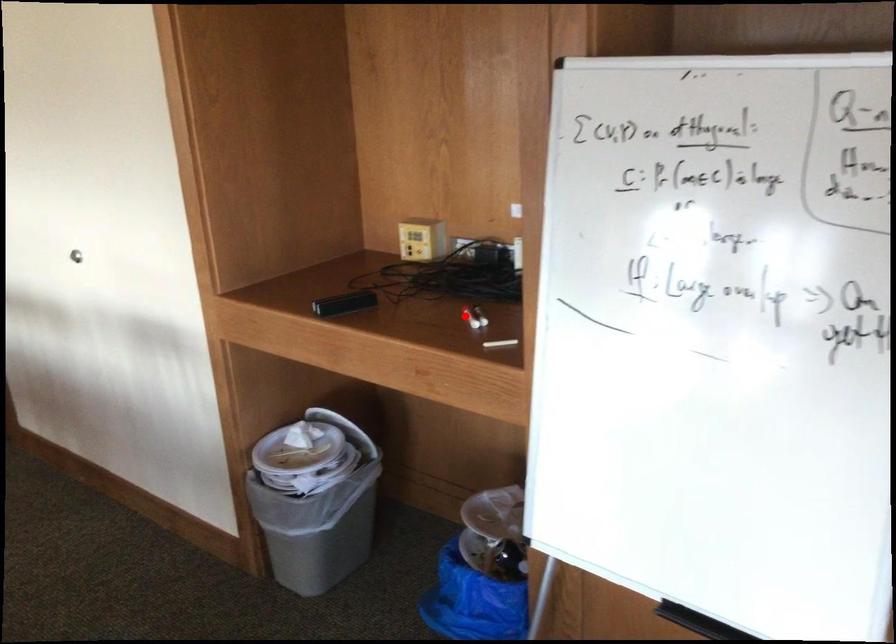
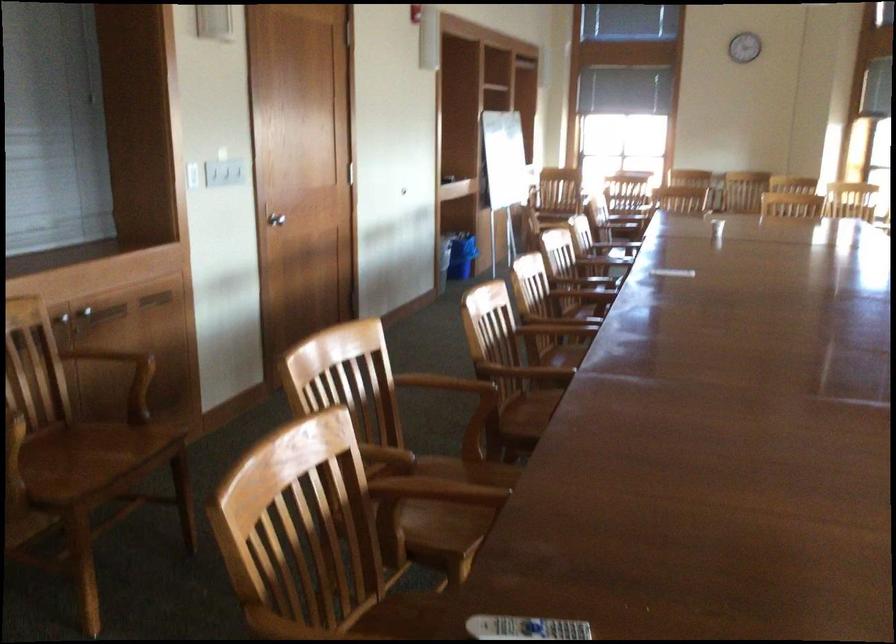
Question: I am providing you with two images of the same scene from different viewpoints. A red point is marked on the first image. Is the red point's position out of view in image 2?

Choices:
 (A) Yes
 (B) No

Answer: (A)